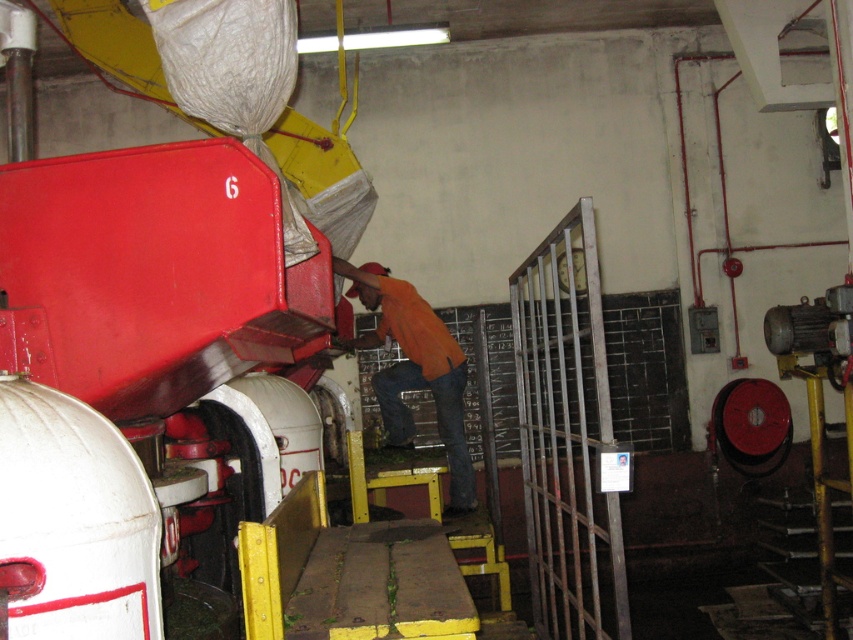
Question: Can you confirm if metallic gate at right is positioned above orange fabric shirt at center?

Choices:
 (A) no
 (B) yes

Answer: (A)

Question: Among these objects, which one is nearest to the camera?

Choices:
 (A) orange fabric shirt at center
 (B) metallic gate at right

Answer: (B)

Question: Is metallic gate at right closer to the viewer compared to orange fabric shirt at center?

Choices:
 (A) yes
 (B) no

Answer: (A)

Question: From the image, what is the correct spatial relationship of metallic gate at right in relation to orange fabric shirt at center?

Choices:
 (A) left
 (B) right

Answer: (B)

Question: Which point appears closest to the camera in this image?

Choices:
 (A) (576, 292)
 (B) (463, 484)

Answer: (B)